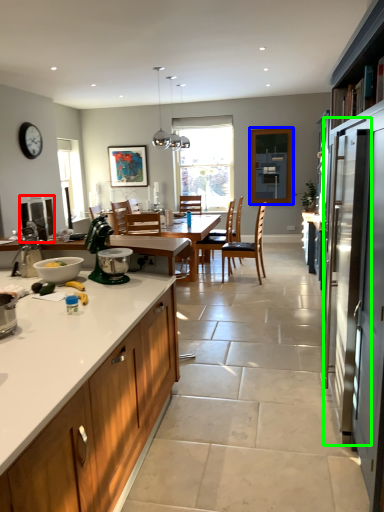
Question: Estimate the real-world distances between objects in this image. Which object is closer to appliance (highlighted by a red box), window screen (highlighted by a blue box) or screen door (highlighted by a green box)?

Choices:
 (A) window screen
 (B) screen door

Answer: (B)